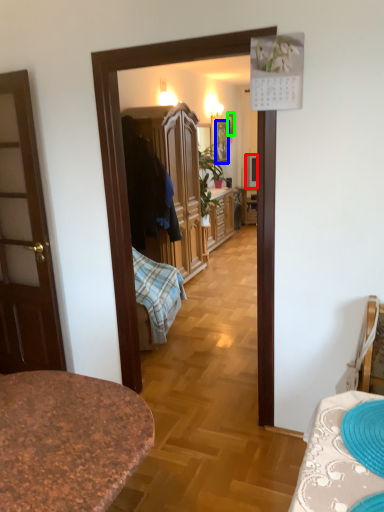
Question: Which is nearer to the television (highlighted by a red box)? picture frame (highlighted by a blue box) or picture frame (highlighted by a green box).

Choices:
 (A) picture frame
 (B) picture frame

Answer: (A)